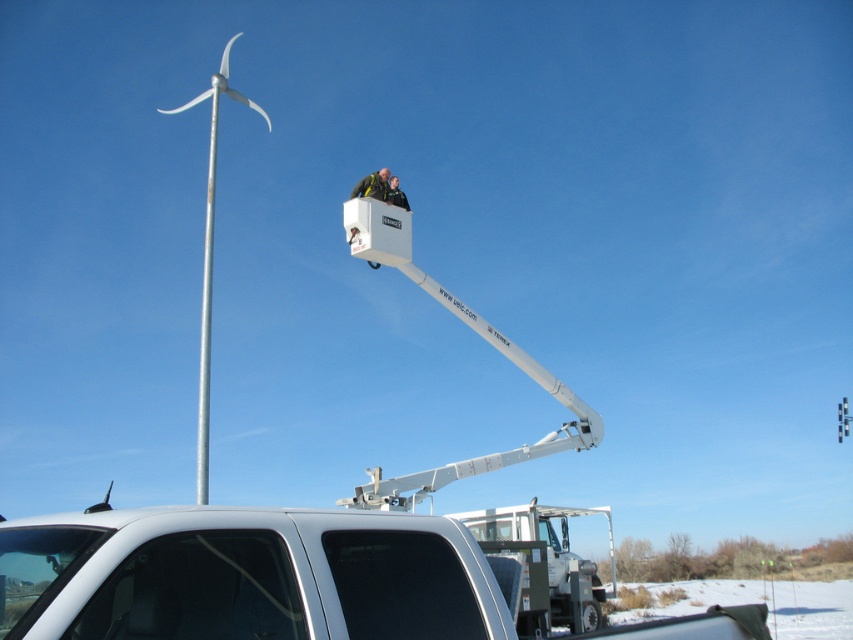
Between white glossy pickup truck at lower left and white plastic trailer truck at lower right, which one appears on the left side from the viewer's perspective?

white glossy pickup truck at lower left

Does white glossy pickup truck at lower left have a smaller size compared to white plastic trailer truck at lower right?

Correct, white glossy pickup truck at lower left occupies less space than white plastic trailer truck at lower right.

Locate an element on the screen. The height and width of the screenshot is (640, 853). white glossy pickup truck at lower left is located at coordinates (245, 577).

At what (x,y) coordinates should I click in order to perform the action: click on white glossy pickup truck at lower left. Please return your answer as a coordinate pair (x, y). Image resolution: width=853 pixels, height=640 pixels. Looking at the image, I should click on (245, 577).

Describe the element at coordinates (544, 564) in the screenshot. I see `white plastic trailer truck at lower right` at that location.

Does point (547, 618) come in front of point (209, 144)?

Yes, point (547, 618) is closer to viewer.

Identify the location of white plastic trailer truck at lower right. The image size is (853, 640). (544, 564).

The height and width of the screenshot is (640, 853). What do you see at coordinates (544, 564) in the screenshot?
I see `white plastic trailer truck at lower right` at bounding box center [544, 564].

Who is shorter, white plastic trailer truck at lower right or green fabric man at upper center?

green fabric man at upper center is shorter.

Who is more distant from viewer, (457,516) or (381,184)?

Point (457,516)

I want to click on white plastic trailer truck at lower right, so click(x=544, y=564).